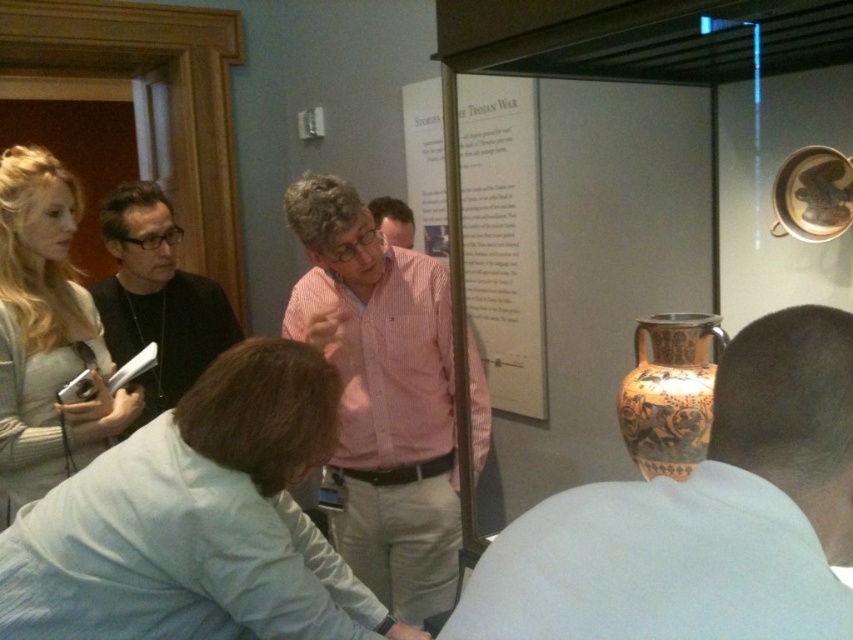
Question: Can you confirm if light blue shirt at lower left is positioned to the right of matte black shirt at left?

Choices:
 (A) no
 (B) yes

Answer: (B)

Question: Does matte orange vase at center appear under light gray sweater at left?

Choices:
 (A) no
 (B) yes

Answer: (B)

Question: Among these points, which one is farthest from the camera?

Choices:
 (A) (67, 561)
 (B) (486, 611)
 (C) (703, 314)
 (D) (402, 209)

Answer: (D)

Question: Considering the real-world distances, which object is farthest from the terracotta painted vase at center?

Choices:
 (A) matte black shirt at left
 (B) pink striped shirt at center
 (C) matte orange vase at center

Answer: (A)

Question: Which is farther from the light gray sweater at left?

Choices:
 (A) matte black shirt at left
 (B) pink striped shirt at center
 (C) matte orange vase at center
 (D) terracotta painted vase at center

Answer: (C)

Question: Is pink striped shirt at center to the right of light gray sweater at left from the viewer's perspective?

Choices:
 (A) yes
 (B) no

Answer: (A)